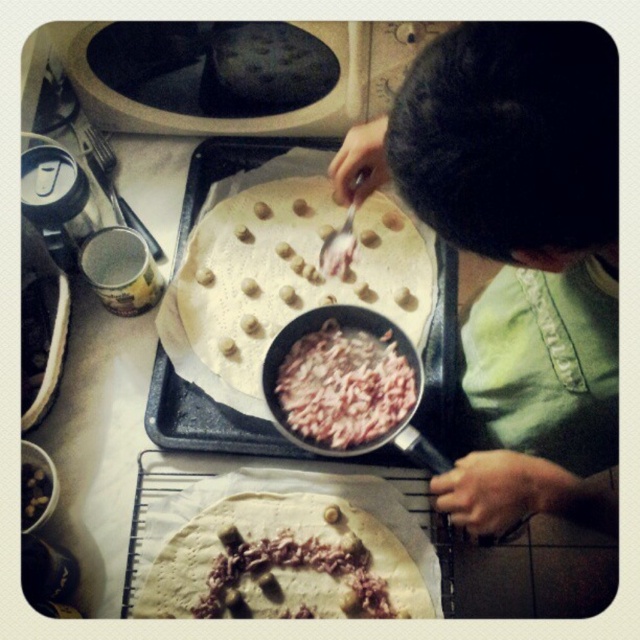
Question: Which point is closer to the camera?

Choices:
 (A) (177, 573)
 (B) (38, 497)
 (C) (307, 449)
 (D) (448, 116)

Answer: (D)

Question: Does green fabric shirt at center have a greater width compared to white matte dough at center?

Choices:
 (A) yes
 (B) no

Answer: (B)

Question: From the image, what is the correct spatial relationship of shiny pink shredded meat at center in relation to dark brown textured nuts at lower left?

Choices:
 (A) right
 (B) left

Answer: (A)

Question: Considering the real-world distances, which object is farthest from the shiny pink shredded meat at center?

Choices:
 (A) white matte dough at center
 (B) shiny pink meat at center
 (C) green fabric shirt at center

Answer: (C)

Question: Is shiny pink shredded meat at center to the right of shiny pink meat at center from the viewer's perspective?

Choices:
 (A) no
 (B) yes

Answer: (A)

Question: Which point is closer to the camera taking this photo?

Choices:
 (A) (48, 481)
 (B) (202, 564)
 (C) (609, 529)
 (D) (228, 312)

Answer: (C)